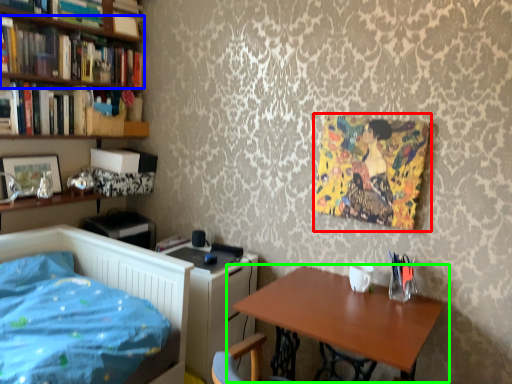
Question: Considering the real-world distances, which object is closest to art (highlighted by a red box)? book (highlighted by a blue box) or table (highlighted by a green box).

Choices:
 (A) book
 (B) table

Answer: (B)